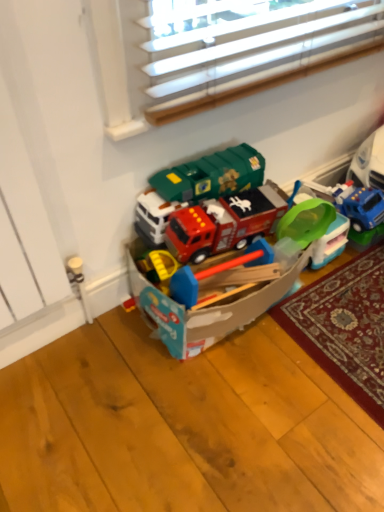
The image size is (384, 512). Find the location of `free space in front of matte plastic toy box at center, which is the 1th toy in left-to-right order`. free space in front of matte plastic toy box at center, which is the 1th toy in left-to-right order is located at coordinates (229, 414).